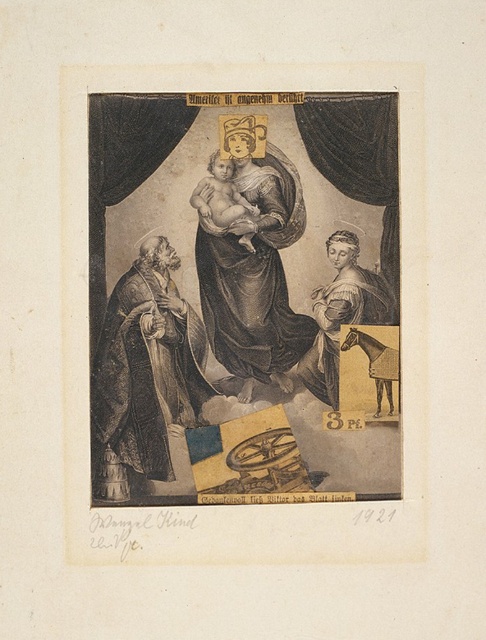
You are an art conservator examining the historical print. You notice the matte gold halo at center and the smooth gold statue at right. Which object could potentially cast a broader shadow given their sizes?

The matte gold halo at center might be wider than smooth gold statue at right, so it could cast a broader shadow.

Based on the scene described, which object is positioned to the right of the other between the matte gold halo at upper center and the smooth flesh baby at center?

The matte gold halo at upper center is to the right of the smooth flesh baby at center according to the description.

You are an art conservator examining this historical print. You notice two points marked at coordinates point (272, 289) and point (340, 292). Based on the spatial relationship between these points, which one is closer to the viewer?

Point (340, 292) is closer to the viewer because it is in front of point (272, 289).